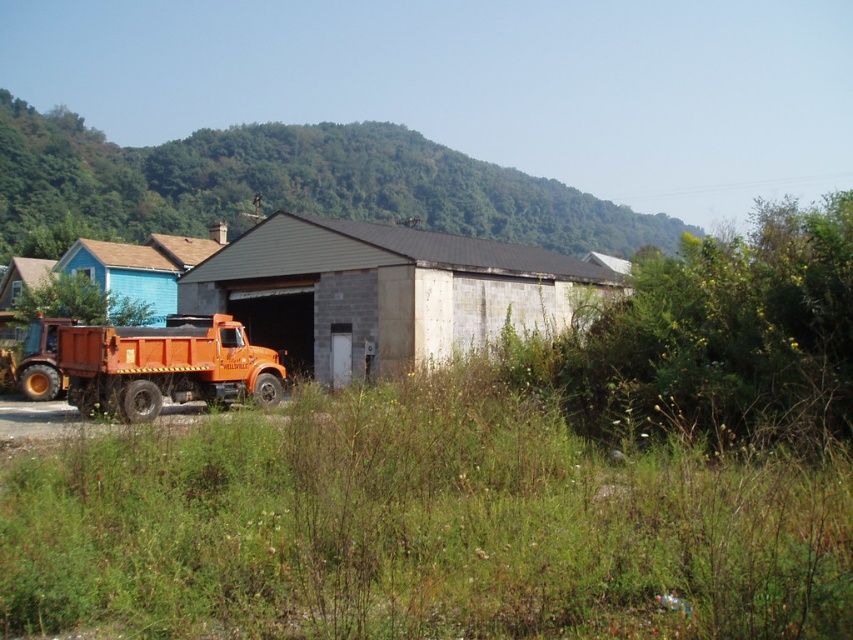
Question: Is gray concrete barn at center positioned behind orange matte dump truck at left?

Choices:
 (A) no
 (B) yes

Answer: (A)

Question: Observing the image, what is the correct spatial positioning of orange metallic truck at left in reference to orange matte truck at center?

Choices:
 (A) left
 (B) right

Answer: (B)

Question: Which point is closer to the camera?

Choices:
 (A) orange matte dump truck at left
 (B) gray concrete barn at center
 (C) green leafy hillside at upper center
 (D) orange matte truck at center

Answer: (B)

Question: Which object is farther from the camera taking this photo?

Choices:
 (A) orange metallic truck at left
 (B) gray concrete barn at center
 (C) green leafy hillside at upper center

Answer: (C)

Question: Which point is farther to the camera?

Choices:
 (A) (140, 500)
 (B) (299, 330)
 (C) (401, 348)

Answer: (B)

Question: Does green leafy hillside at upper center appear on the right side of gray concrete barn at center?

Choices:
 (A) no
 (B) yes

Answer: (B)